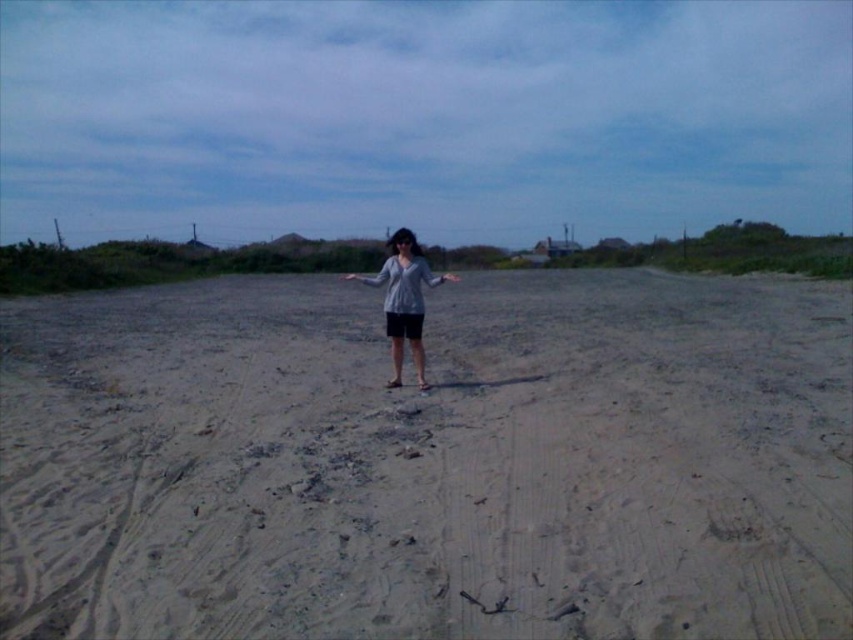
Is light brown sandy ground at center smaller than gray matte sweater at center?

Indeed, light brown sandy ground at center has a smaller size compared to gray matte sweater at center.

Image resolution: width=853 pixels, height=640 pixels. Describe the element at coordinates (428, 460) in the screenshot. I see `light brown sandy ground at center` at that location.

Identify the location of light brown sandy ground at center. (428, 460).